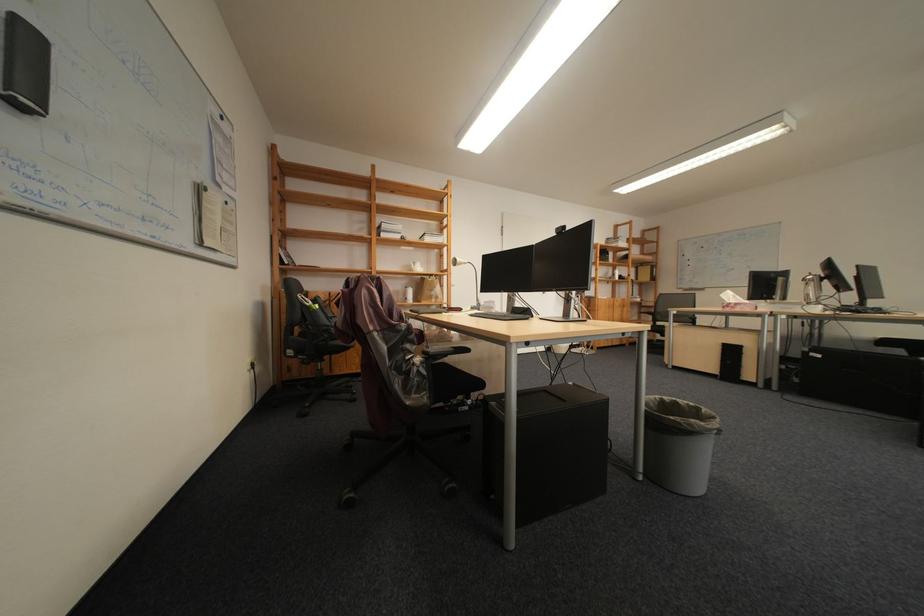
Find where to sit the black chair sitting surface. Please return your answer as a coordinate pair (x, y).

(443, 382)